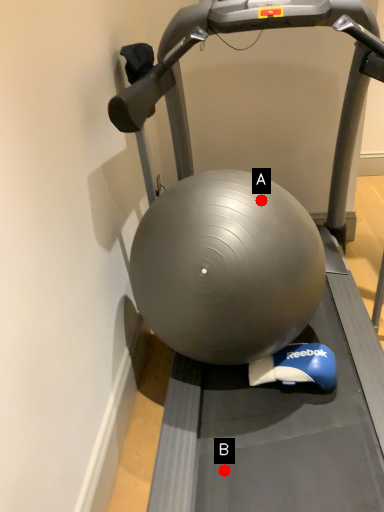
Question: Two points are circled on the image, labeled by A and B beside each circle. Which point is farther from the camera taking this photo?

Choices:
 (A) A is further
 (B) B is further

Answer: (A)